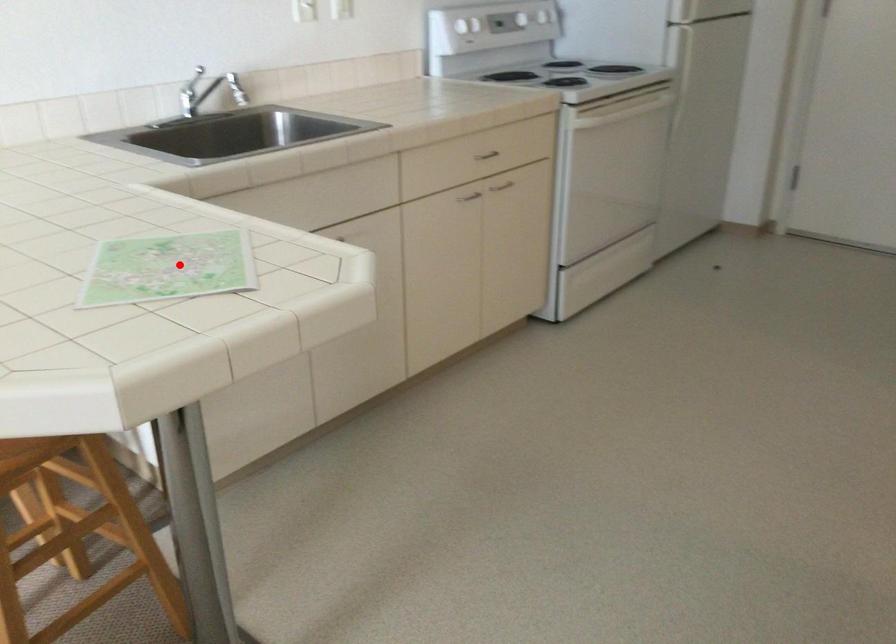
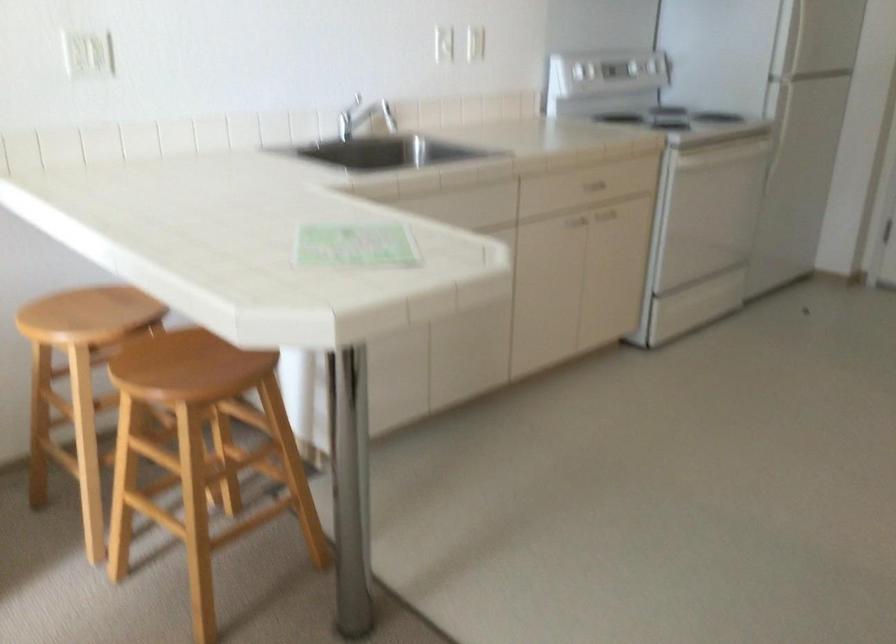
Find the pixel in the second image that matches the highlighted location in the first image.

(355, 245)